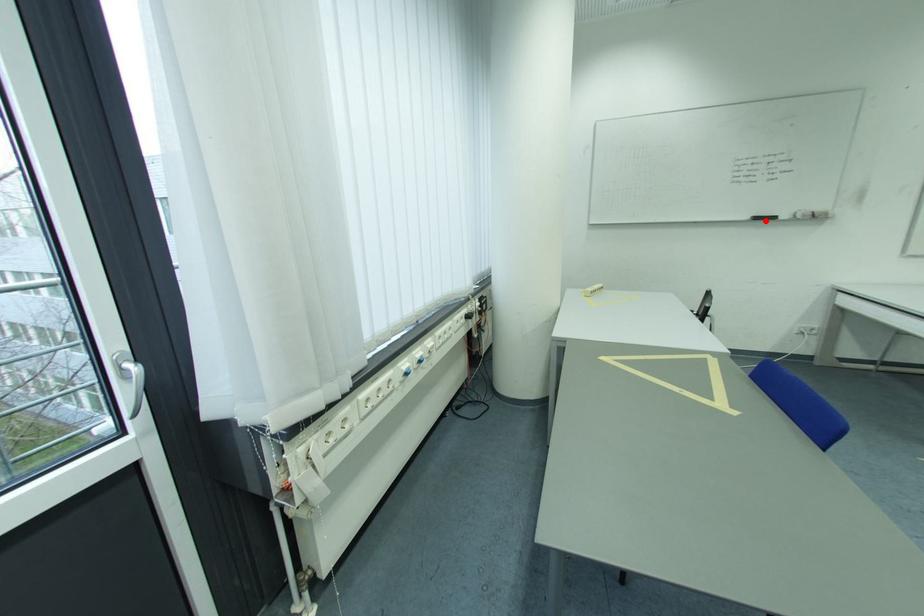
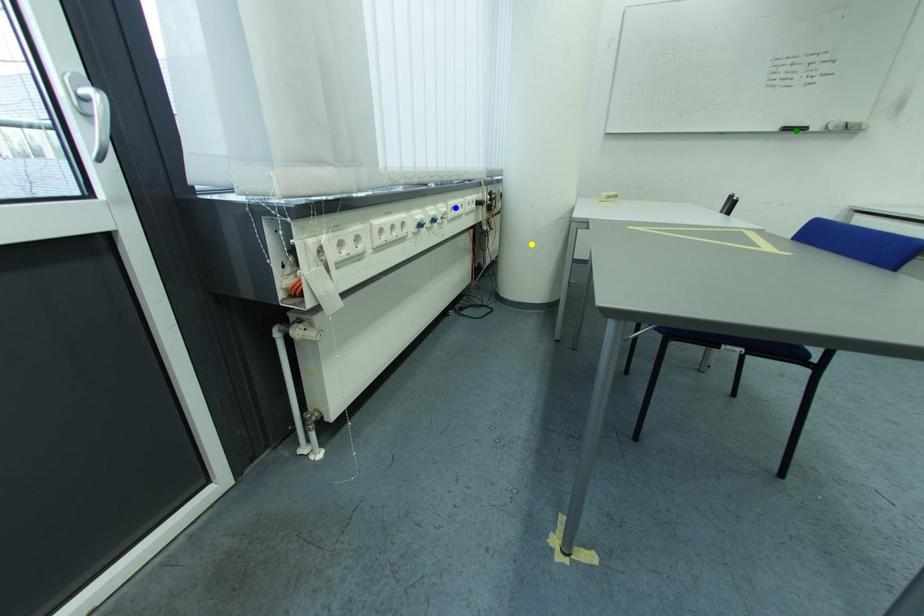
Question: I am providing you with two images of the same scene from different viewpoints. A red point is marked on the first image. You are given multiple points on the second image. Which point in image 2 is actually the same real-world point as the red point in image 1?

Choices:
 (A) blue point
 (B) yellow point
 (C) green point

Answer: (C)